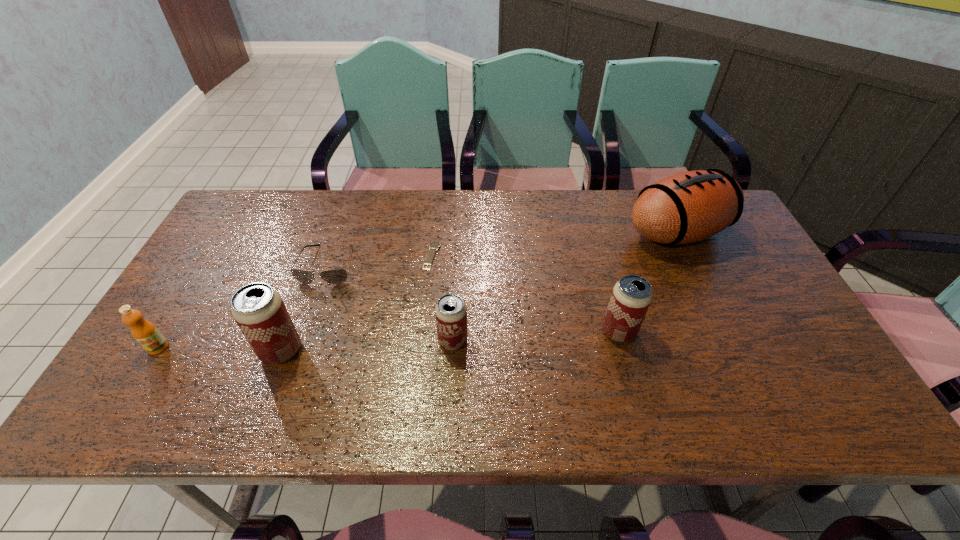
The height and width of the screenshot is (540, 960). I want to click on object at the left edge, so click(x=146, y=334).

Where is `object located at the right edge`? object located at the right edge is located at coordinates (687, 207).

The width and height of the screenshot is (960, 540). In order to click on object that is at the near left corner in this screenshot , I will do `click(146, 334)`.

At what (x,y) coordinates should I click in order to perform the action: click on object present at the far right corner. Please return your answer as a coordinate pair (x, y). Looking at the image, I should click on (687, 207).

The image size is (960, 540). In the image, there is a desktop. Find the location of `vacant space at the far edge`. vacant space at the far edge is located at coordinates coord(418,214).

The width and height of the screenshot is (960, 540). In order to click on free region at the near edge in this screenshot , I will do `click(467, 357)`.

What are the coordinates of `vacant region at the right edge of the desktop` in the screenshot? It's located at (713, 264).

Locate an element on the screen. This screenshot has height=540, width=960. free region at the far left corner of the desktop is located at coordinates (263, 190).

You are a GUI agent. You are given a task and a screenshot of the screen. Output one action in this format:
    pyautogui.click(x=<x>, y=<y>)
    Task: Click on the free region at the near right corner of the desktop
    
    Given the screenshot: What is the action you would take?
    pyautogui.click(x=815, y=364)

The height and width of the screenshot is (540, 960). I want to click on unoccupied area between the leftmost object and the watch, so click(295, 301).